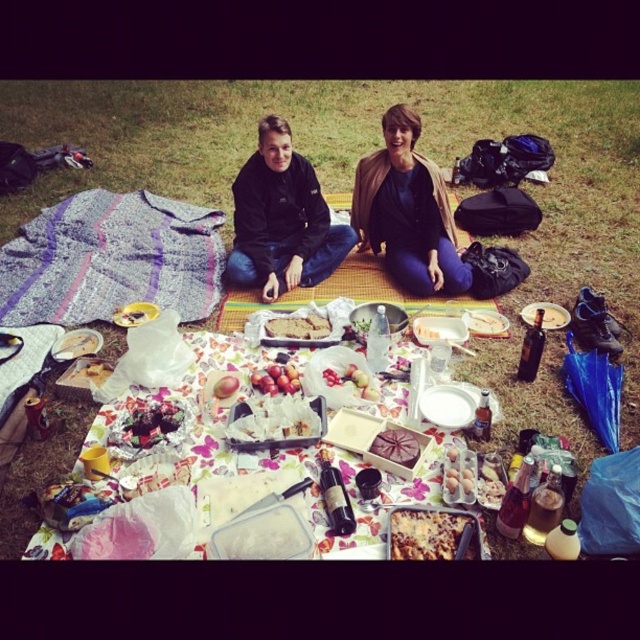
Does matte black jacket at center have a lesser width compared to smooth red apple at center?

No.

In the scene shown: Who is more distant from viewer, (371, 227) or (228, 376)?

Point (371, 227)

The width and height of the screenshot is (640, 640). In order to click on matte black jacket at center in this screenshot , I will do `click(406, 211)`.

This screenshot has height=640, width=640. Describe the element at coordinates (112, 259) in the screenshot. I see `striped fabric picnic blanket at center` at that location.

Is striped fabric picnic blanket at center below white paper plate at center?

No, striped fabric picnic blanket at center is not below white paper plate at center.

At what (x,y) coordinates should I click in order to perform the action: click on striped fabric picnic blanket at center. Please return your answer as a coordinate pair (x, y). Looking at the image, I should click on (112, 259).

Does smooth red apple at center have a lesser height compared to matte plastic bag at center?

Yes, smooth red apple at center is shorter than matte plastic bag at center.

Who is more forward, (x=232, y=380) or (x=116, y=316)?

Point (x=232, y=380) is in front.

Is point (228, 374) positioned in front of point (131, 323)?

Yes, point (228, 374) is in front of point (131, 323).

Locate an element on the screen. The image size is (640, 640). smooth red apple at center is located at coordinates (225, 387).